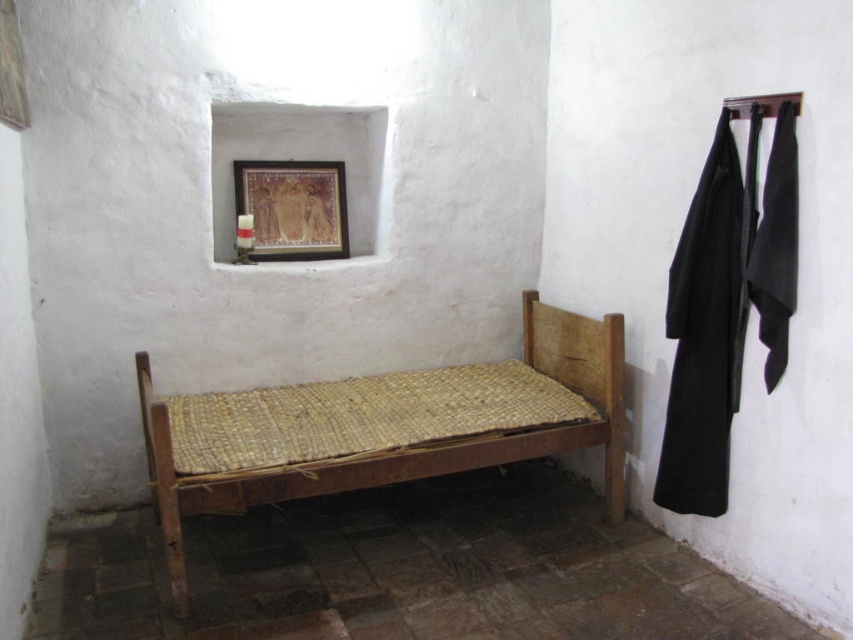
You are standing in the room and want to walk towards the two points marked in the image. Which point will you reach first, point (154, 413) or point (247, 198)?

Point (154, 413) is closer to the camera than point (247, 198), so you will reach point (154, 413) first.